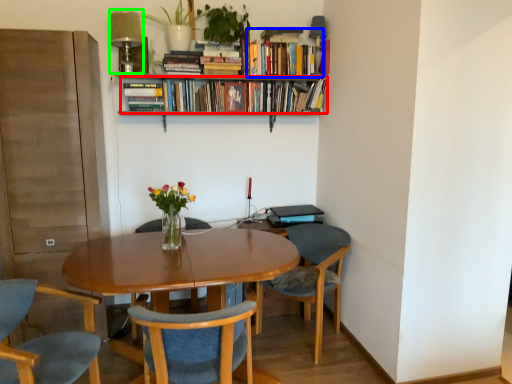
Question: Which is farther away from book (highlighted by a red box)? book (highlighted by a blue box) or lamp (highlighted by a green box)?

Choices:
 (A) book
 (B) lamp

Answer: (B)